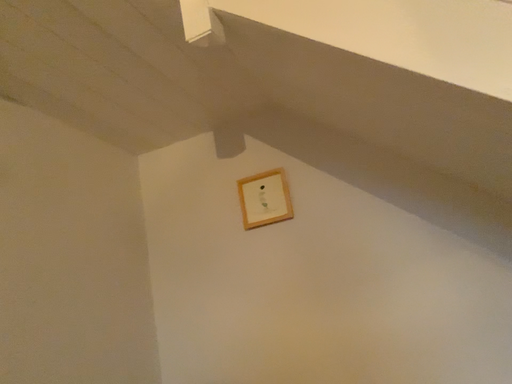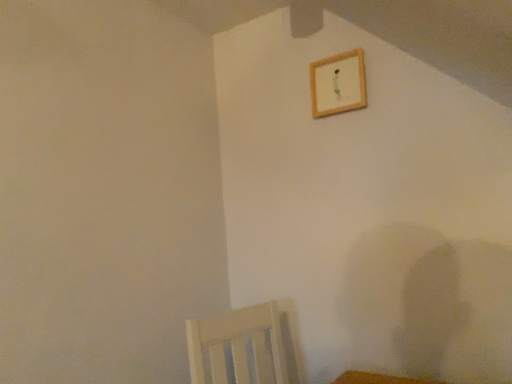
Question: How did the camera likely rotate when shooting the video?

Choices:
 (A) rotated downward
 (B) rotated upward

Answer: (A)